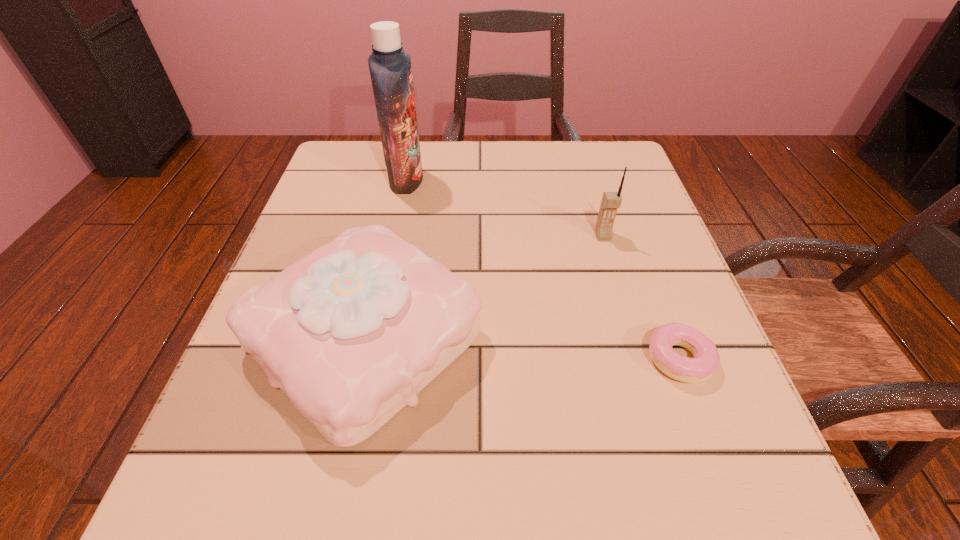
You are a GUI agent. You are given a task and a screenshot of the screen. Output one action in this format:
    pyautogui.click(x=<x>, y=<y>)
    Task: Click on the vacant point at the left edge
    
    Given the screenshot: What is the action you would take?
    pyautogui.click(x=331, y=237)

The image size is (960, 540). In order to click on vacant space at the right edge of the desktop in this screenshot , I will do `click(641, 261)`.

The width and height of the screenshot is (960, 540). What are the coordinates of `vacant area at the far left corner` in the screenshot? It's located at (366, 145).

Locate an element on the screen. The width and height of the screenshot is (960, 540). vacant space in between the second tallest object and the tallest object is located at coordinates (504, 208).

Image resolution: width=960 pixels, height=540 pixels. What are the coordinates of `free area in between the cake and the cellular telephone` in the screenshot? It's located at point(484,287).

The width and height of the screenshot is (960, 540). I want to click on vacant space in between the farthest object and the second farthest object, so click(x=504, y=208).

Image resolution: width=960 pixels, height=540 pixels. Identify the location of free space that is in between the second shortest object and the shortest object. (522, 348).

Find the location of a particular element. vacant area that lies between the shortest object and the third tallest object is located at coordinates (522, 348).

Where is `free area in between the second farthest object and the cake`? The image size is (960, 540). free area in between the second farthest object and the cake is located at coordinates (484, 287).

I want to click on vacant region between the tallest object and the doughnut, so click(x=542, y=269).